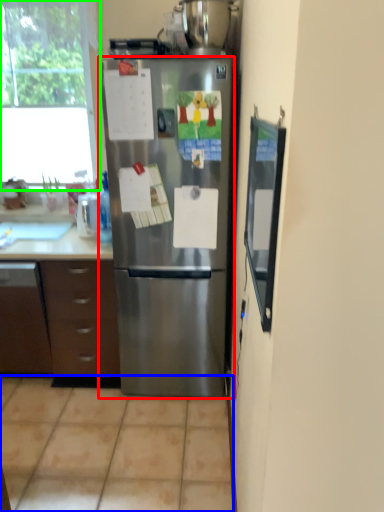
Question: Which object is the closest to the refrigerator (highlighted by a red box)? Choose among these: tile (highlighted by a blue box) or window (highlighted by a green box).

Choices:
 (A) tile
 (B) window

Answer: (A)